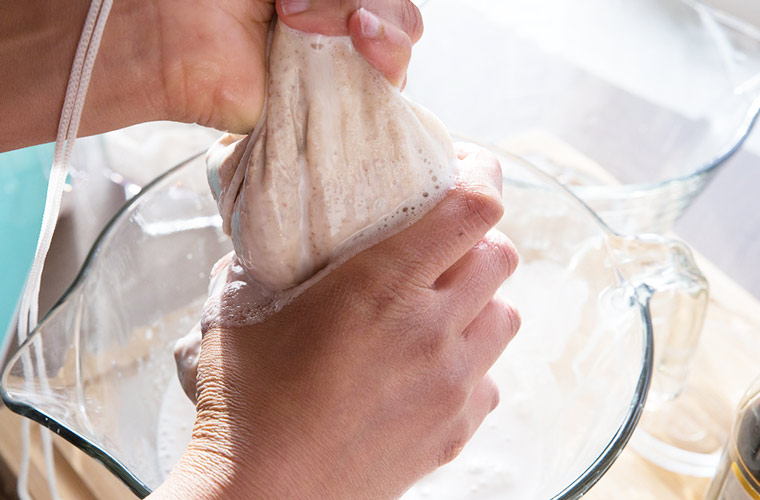
You are a GUI agent. You are given a task and a screenshot of the screen. Output one action in this format:
    pyautogui.click(x=<x>, y=<y>)
    Task: Click on the counter in front of pitcher
    This screenshot has height=500, width=760.
    Given the screenshot: What is the action you would take?
    pyautogui.click(x=14, y=440)